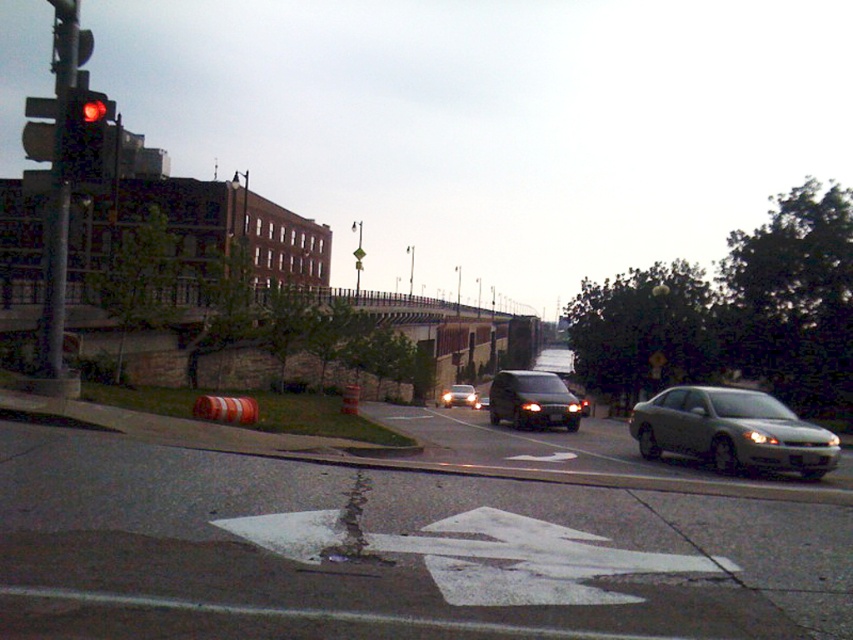
Consider the image. You are driving a car that is 5 meters long. You are approaching the satin black van at center and need to stop behind the red glass traffic light at left. Can your car fit completely behind the van before reaching the traffic light?

The distance between the red glass traffic light at left and the satin black van at center is 48.93 meters. Since your car is only 5 meters long, there is more than enough space to safely stop behind the satin black van at center before reaching the traffic light.

You are a delivery driver trying to park your truck in a narrow alley. You see a matte black van at center and a satin black van at center in the image. Which van should you avoid if you want to minimize the risk of scraping the sides of your truck against the alley walls?

The matte black van at center might be wider than the satin black van at center, so you should avoid the matte black van at center to minimize the risk of scraping the sides of your truck against the alley walls.

You are a pedestrian standing on the sidewalk and want to cross the street to reach a store located beyond the matte black van at center. The red glass traffic light at left is currently red. Can you safely cross the street now?

The red glass traffic light at left being red means vehicles must stop, but since the matte black van at center is closer to you than the traffic light, you should check if the van is stopped before crossing. If the van has stopped, it might be safe to cross carefully.